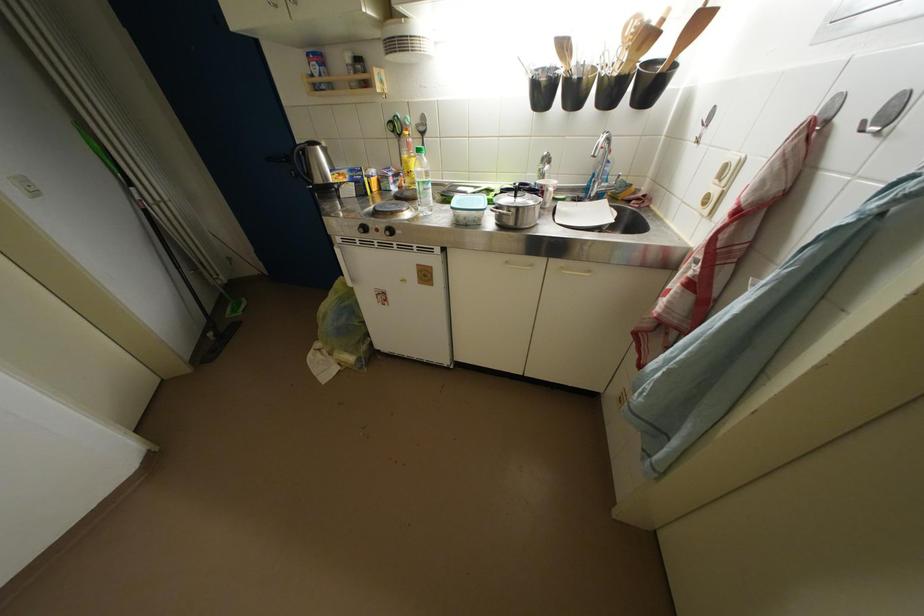
Find where to lift the black kettle. Please return your answer as a coordinate pair (x, y).

(299, 169)